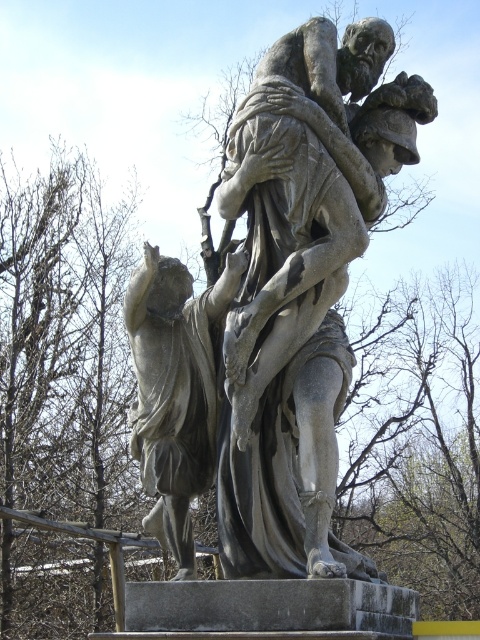
You are a photographer adjusting your camera settings to focus on two specific points in the sculpture scene. The points are labeled as point (x=268, y=86) and point (x=189, y=448). Since you can only focus on one point at a time, which point should you choose to ensure the other point remains in focus due to depth of field? Explain your reasoning based on their positions.

Point (x=268, y=86) is further to the camera than point (x=189, y=448). To keep both points in focus, you should focus on the point closer to the camera, which is point (x=189, y=448). This way, the depth of field will extend backward to include the farther point as well.

You are standing in a park and see the gray stone sculpture at center. If you want to take a photo of it from the front, where should you position yourself relative to the sculpture?

The gray stone sculpture at center is located at point (x=275, y=308), so you should position yourself directly in front of it to capture the front view.